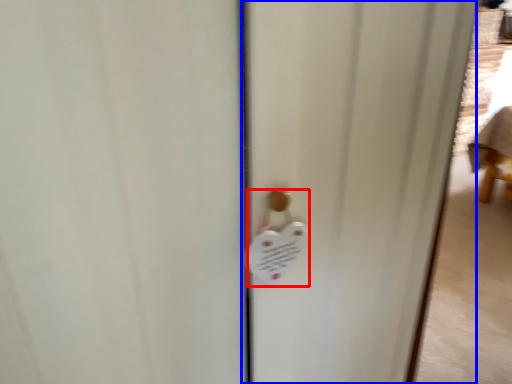
Question: Which point is further to the camera, lock (highlighted by a red box) or screen door (highlighted by a blue box)?

Choices:
 (A) lock
 (B) screen door

Answer: (B)